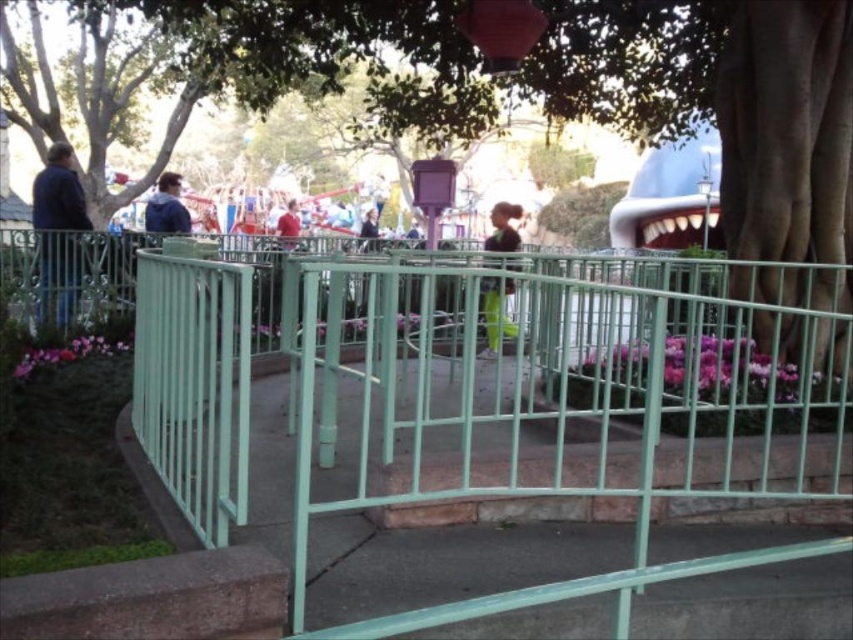
Is point (178, 225) closer to camera compared to point (287, 234)?

Yes.

I want to click on blue fabric jacket at upper left, so click(166, 208).

Find the location of `blue fabric jacket at upper left`. blue fabric jacket at upper left is located at coordinates (166, 208).

Between point (47, 257) and point (160, 195), which one is positioned behind?

Positioned behind is point (160, 195).

Does dark blue jacket at left have a larger size compared to blue fabric jacket at upper left?

Yes.

Between point (64, 214) and point (165, 205), which one is positioned behind?

Positioned behind is point (165, 205).

The height and width of the screenshot is (640, 853). What are the coordinates of `dark blue jacket at left` in the screenshot? It's located at (57, 230).

Does green fabric pants at center appear on the right side of blue fabric jacket at upper left?

Indeed, green fabric pants at center is positioned on the right side of blue fabric jacket at upper left.

Does point (508, 276) come in front of point (148, 224)?

Yes, it is.

I want to click on green fabric pants at center, so click(x=494, y=314).